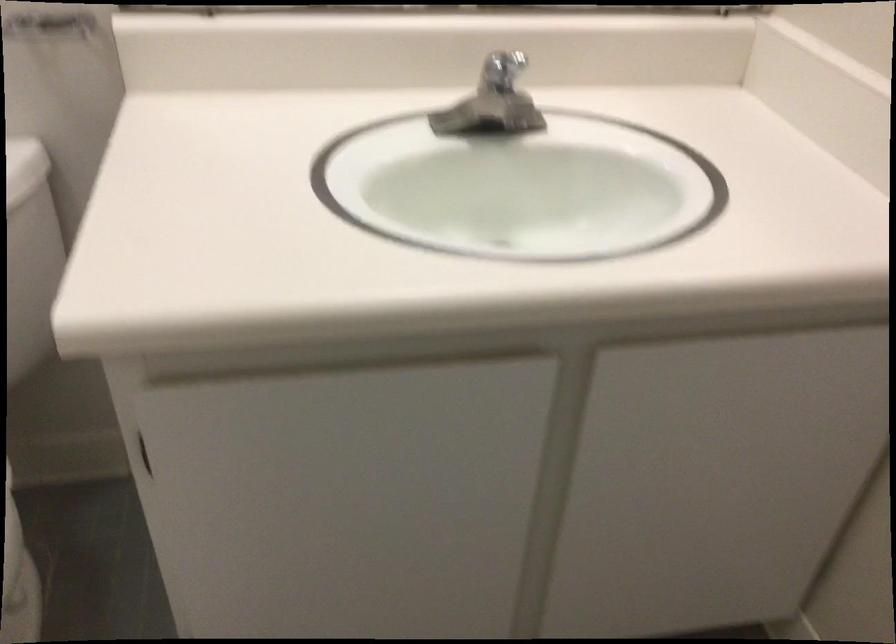
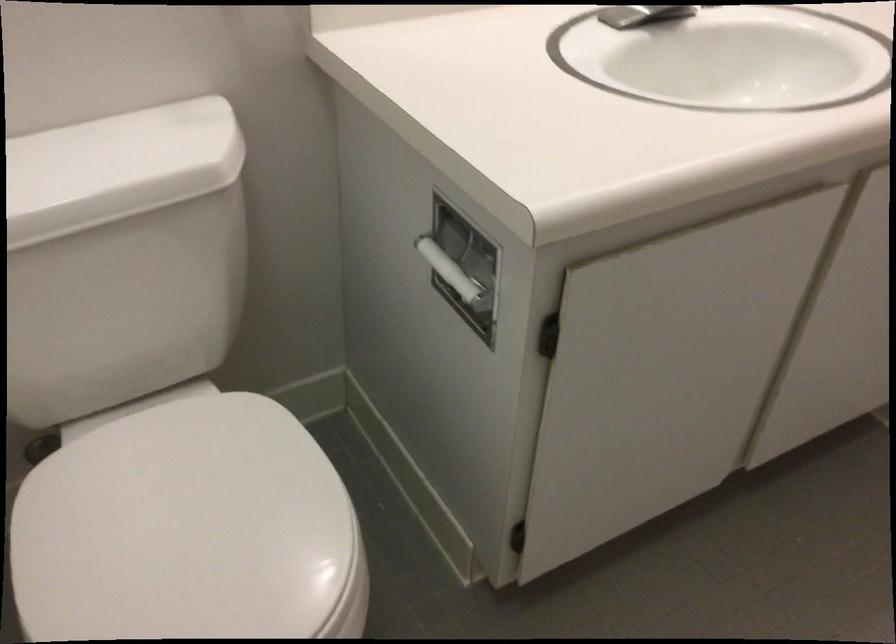
Question: What movement of the cameraman would produce the second image?

Choices:
 (A) Left
 (B) Right
 (C) Forward
 (D) Backward

Answer: (A)